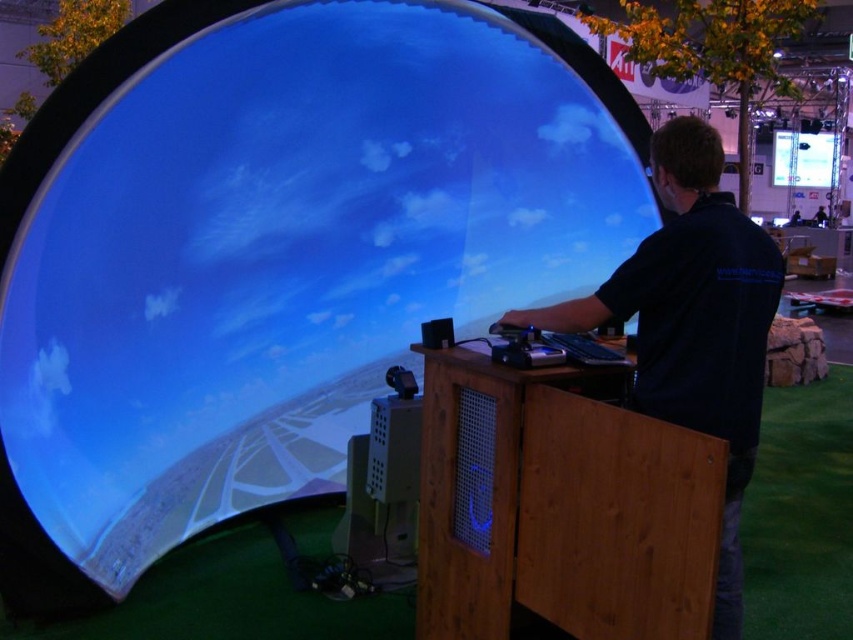
You are at the trade show and want to interact with the VR simulation setup. Where is the wooden table at center located in the scene?

The wooden table at center is located at the 2D coordinates point (560, 506) in the scene.